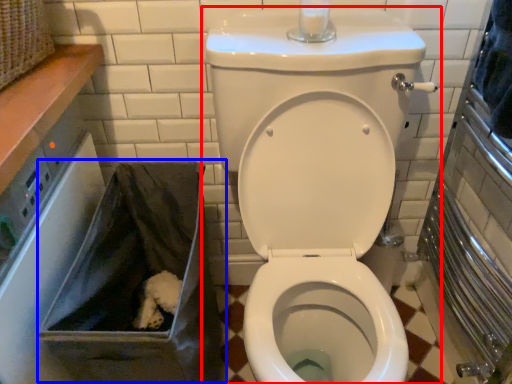
Question: Which object appears farthest to the camera in this image, toilet (highlighted by a red box) or recycling bin (highlighted by a blue box)?

Choices:
 (A) toilet
 (B) recycling bin

Answer: (B)